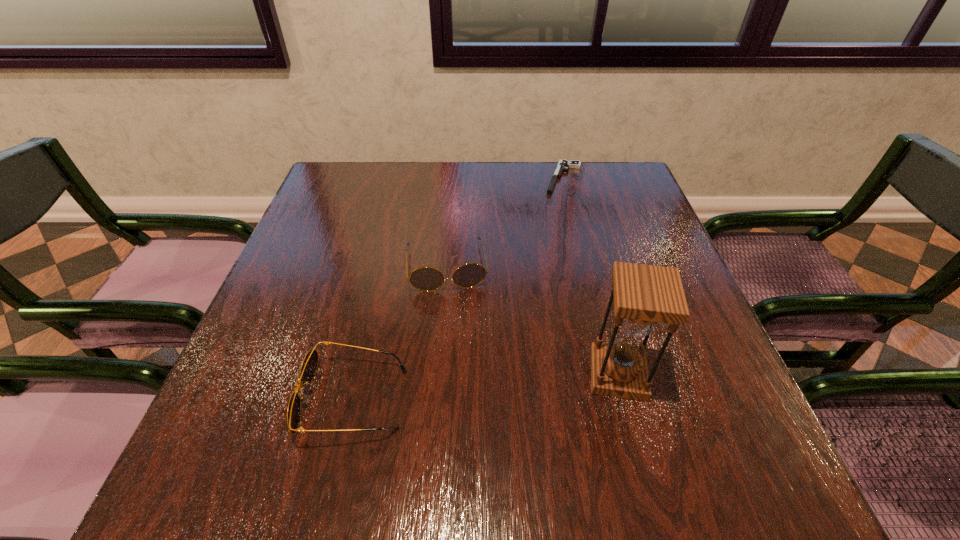
You are a GUI agent. You are given a task and a screenshot of the screen. Output one action in this format:
    pyautogui.click(x=<x>, y=<y>)
    Task: Click on the vacant area between the third nearest object and the pistol
    
    Given the screenshot: What is the action you would take?
    [x=505, y=222]

In order to click on free space between the third nearest object and the tallest object in this screenshot , I will do 532,320.

At what (x,y) coordinates should I click in order to perform the action: click on free spot between the shorter sunglasses and the tallest object. Please return your answer as a coordinate pair (x, y). Image resolution: width=960 pixels, height=540 pixels. Looking at the image, I should click on (486, 387).

Where is `free space between the nearer sunglasses and the hourglass`? This screenshot has height=540, width=960. free space between the nearer sunglasses and the hourglass is located at coordinates (486, 387).

This screenshot has height=540, width=960. What are the coordinates of `vacant space that is in between the shorter sunglasses and the pistol` in the screenshot? It's located at (459, 289).

Locate an element on the screen. The width and height of the screenshot is (960, 540). unoccupied area between the shorter sunglasses and the second tallest object is located at coordinates (400, 333).

Locate an element on the screen. vacant area that lies between the taller sunglasses and the hourglass is located at coordinates (532, 320).

Identify the location of free spot between the nearer sunglasses and the hourglass. This screenshot has width=960, height=540. coord(486,387).

Identify the location of free spot between the pistol and the tallest object. point(590,276).

You are a GUI agent. You are given a task and a screenshot of the screen. Output one action in this format:
    pyautogui.click(x=<x>, y=<y>)
    Task: Click on the free space between the hourglass and the third tallest object
    Image resolution: width=960 pixels, height=540 pixels.
    Given the screenshot: What is the action you would take?
    pyautogui.click(x=486, y=387)